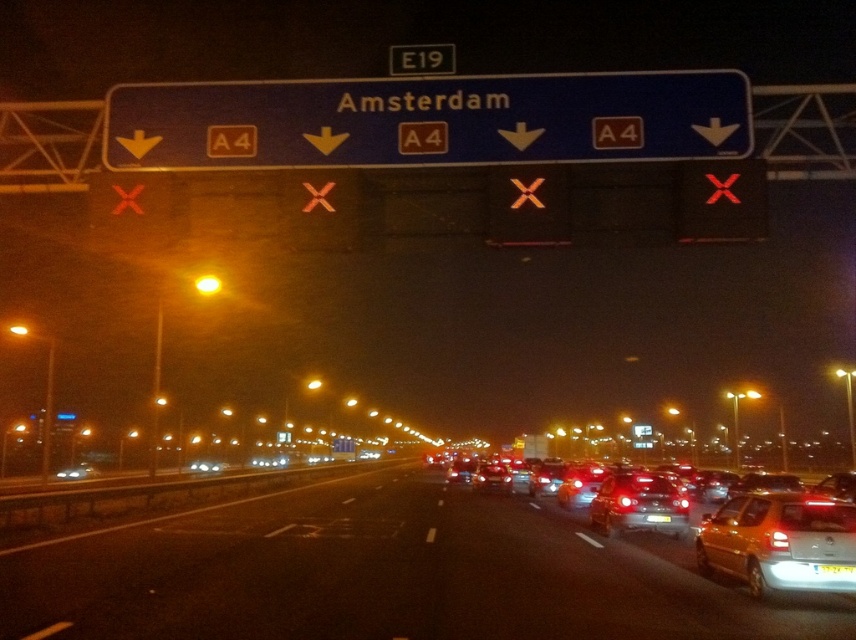
You are a driver in a car on the highway. You see the point marked at coordinates (777, 541). What object is located at that point?

The point at coordinates (777, 541) corresponds to the yellow matte car at lower right.

You are driving a car and see the blue plastic sign at upper center and the shiny metallic car at center ahead. Which object is narrower in width?

The blue plastic sign at upper center has a lesser width compared to the shiny metallic car at center, so the blue plastic sign at upper center is narrower.

You are driving at night and see the blue plastic sign at upper center and the white plastic license plate at center. Which object is wider?

The white plastic license plate at center is wider than the blue plastic sign at upper center.